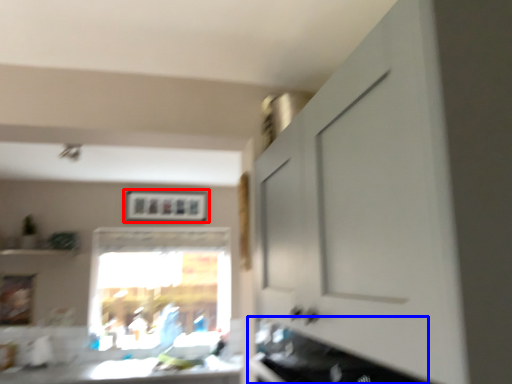
Question: Among these objects, which one is nearest to the camera, picture frame (highlighted by a red box) or cabinetry (highlighted by a blue box)?

Choices:
 (A) picture frame
 (B) cabinetry

Answer: (B)